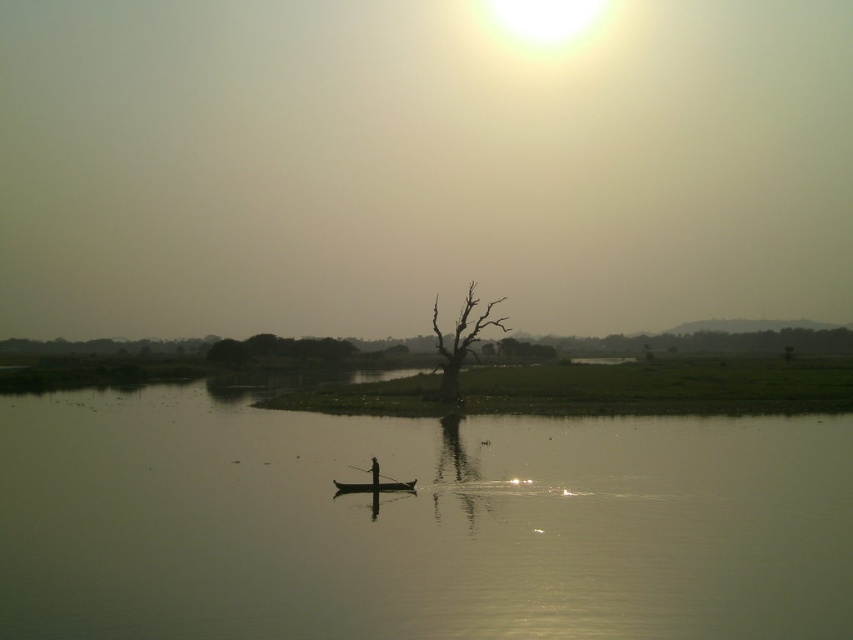
Is greenish water at center to the right of black wood paddle at center from the viewer's perspective?

Yes, greenish water at center is to the right of black wood paddle at center.

Does greenish water at center appear on the left side of black wood paddle at center?

Incorrect, greenish water at center is not on the left side of black wood paddle at center.

Describe the element at coordinates (416, 524) in the screenshot. This screenshot has height=640, width=853. I see `greenish water at center` at that location.

At what (x,y) coordinates should I click in order to perform the action: click on greenish water at center. Please return your answer as a coordinate pair (x, y). This screenshot has height=640, width=853. Looking at the image, I should click on (416, 524).

Who is shorter, greenish water at center or wooden canoe at center?

wooden canoe at center is shorter.

Consider the image. Does greenish water at center have a larger size compared to wooden canoe at center?

Yes.

Between point (509, 566) and point (369, 483), which one is positioned behind?

Positioned behind is point (369, 483).

The height and width of the screenshot is (640, 853). What are the coordinates of `greenish water at center` in the screenshot? It's located at (416, 524).

Who is more forward, (137, 632) or (376, 481)?

Point (137, 632) is more forward.

Is greenish water at center wider than silhouette wood person at center?

Yes.

The height and width of the screenshot is (640, 853). Find the location of `greenish water at center`. greenish water at center is located at coordinates 416,524.